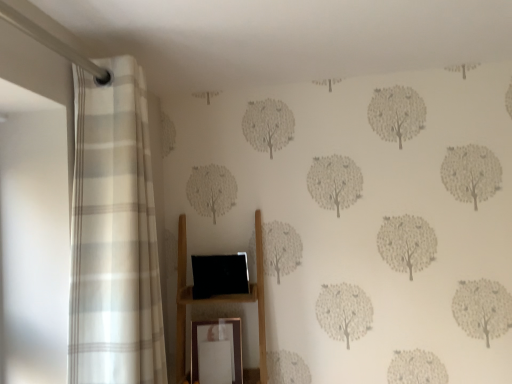
The width and height of the screenshot is (512, 384). What do you see at coordinates (220, 302) in the screenshot?
I see `wooden shelf at center` at bounding box center [220, 302].

The height and width of the screenshot is (384, 512). I want to click on gold metallic picture frame at lower center, so click(x=218, y=341).

Are white striped curtain at left and gold metallic picture frame at lower center located far from each other?

white striped curtain at left is actually quite close to gold metallic picture frame at lower center.

Is white striped curtain at left taller or shorter than gold metallic picture frame at lower center?

white striped curtain at left is taller than gold metallic picture frame at lower center.

Considering the positions of point (112, 113) and point (233, 373), is point (112, 113) closer or farther from the camera than point (233, 373)?

Point (112, 113) is closer to the camera than point (233, 373).

Is gold metallic picture frame at lower center aimed at white striped curtain at left?

Yes, gold metallic picture frame at lower center is oriented towards white striped curtain at left.

Looking at this image, from the image's perspective, does gold metallic picture frame at lower center appear higher than white striped curtain at left?

Incorrect, from the image's perspective, gold metallic picture frame at lower center is lower than white striped curtain at left.

Considering the positions of objects gold metallic picture frame at lower center and white striped curtain at left in the image provided, who is in front, gold metallic picture frame at lower center or white striped curtain at left?

white striped curtain at left is in front.

Considering the relative sizes of gold metallic picture frame at lower center and white striped curtain at left in the image provided, is gold metallic picture frame at lower center bigger than white striped curtain at left?

Incorrect, gold metallic picture frame at lower center is not larger than white striped curtain at left.

Is wooden shelf at center looking in the opposite direction of white striped curtain at left?

No, wooden shelf at center is not facing away from white striped curtain at left.

Looking at this image, is wooden shelf at center next to white striped curtain at left?

They are not placed beside each other.

From the image's perspective, which one is positioned lower, wooden shelf at center or white striped curtain at left?

wooden shelf at center is shown below in the image.

Between wooden shelf at center and white striped curtain at left, which one is positioned behind?

wooden shelf at center is further from the camera.

There is a wooden shelf at center. What are the coordinates of `curtain above it (from a real-world perspective)` in the screenshot? It's located at (114, 235).

Based on the photo, between white striped curtain at left and wooden shelf at center, which one has smaller width?

With smaller width is white striped curtain at left.

Considering the positions of objects white striped curtain at left and wooden shelf at center in the image provided, who is behind, white striped curtain at left or wooden shelf at center?

Positioned behind is wooden shelf at center.

Considering the sizes of objects gold metallic picture frame at lower center and wooden shelf at center in the image provided, who is wider, gold metallic picture frame at lower center or wooden shelf at center?

wooden shelf at center is wider.

Is there a large distance between gold metallic picture frame at lower center and wooden shelf at center?

No, gold metallic picture frame at lower center is not far away from wooden shelf at center.

Between gold metallic picture frame at lower center and wooden shelf at center, which one appears on the left side from the viewer's perspective?

wooden shelf at center is more to the left.

Is gold metallic picture frame at lower center oriented away from wooden shelf at center?

Correct, gold metallic picture frame at lower center is looking away from wooden shelf at center.

Are wooden shelf at center and gold metallic picture frame at lower center beside each other?

No, wooden shelf at center is not with gold metallic picture frame at lower center.

Considering the sizes of objects wooden shelf at center and gold metallic picture frame at lower center in the image provided, who is bigger, wooden shelf at center or gold metallic picture frame at lower center?

wooden shelf at center.

Is wooden shelf at center inside or outside of gold metallic picture frame at lower center?

The correct answer is: outside.

Does wooden shelf at center have a greater width compared to gold metallic picture frame at lower center?

Indeed, wooden shelf at center has a greater width compared to gold metallic picture frame at lower center.

The width and height of the screenshot is (512, 384). In order to click on picture frame below the white striped curtain at left (from a real-world perspective) in this screenshot , I will do `click(218, 341)`.

Where is `curtain that is above the gold metallic picture frame at lower center (from a real-world perspective)`? curtain that is above the gold metallic picture frame at lower center (from a real-world perspective) is located at coordinates (114, 235).

Which object lies nearer to the anchor point gold metallic picture frame at lower center, white striped curtain at left or wooden shelf at center?

wooden shelf at center lies closer to gold metallic picture frame at lower center than the other object.

When comparing their distances from wooden shelf at center, does gold metallic picture frame at lower center or white striped curtain at left seem further?

Among the two, white striped curtain at left is located further to wooden shelf at center.

From the image, which object appears to be nearer to white striped curtain at left, wooden shelf at center or gold metallic picture frame at lower center?

wooden shelf at center is closer to white striped curtain at left.

Based on their spatial positions, is gold metallic picture frame at lower center or wooden shelf at center closer to white striped curtain at left?

wooden shelf at center.

When comparing their distances from wooden shelf at center, does white striped curtain at left or gold metallic picture frame at lower center seem closer?

gold metallic picture frame at lower center.

From the image, which object appears to be nearer to gold metallic picture frame at lower center, wooden shelf at center or white striped curtain at left?

The object closer to gold metallic picture frame at lower center is wooden shelf at center.

Find the location of a particular element. furniture between white striped curtain at left and gold metallic picture frame at lower center from front to back is located at coordinates (220, 302).